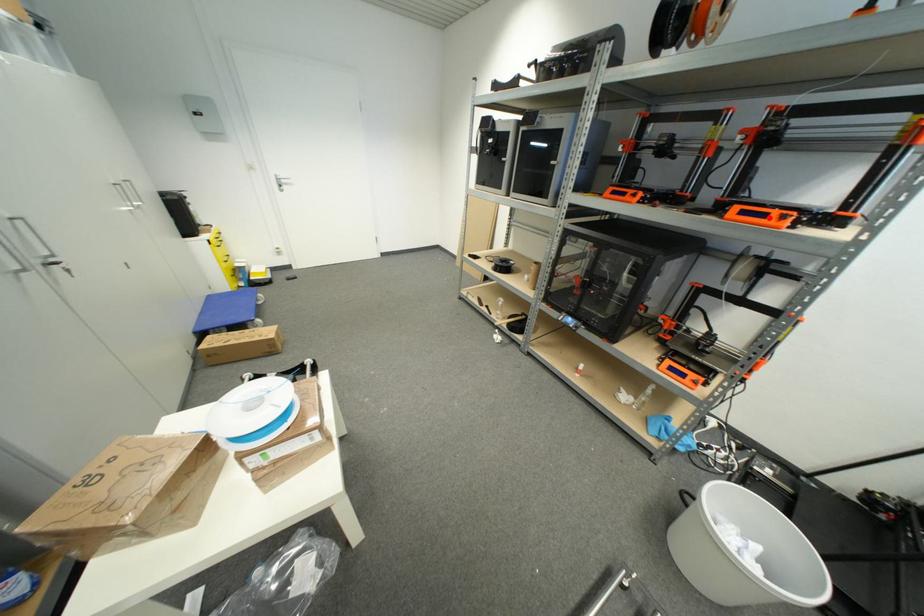
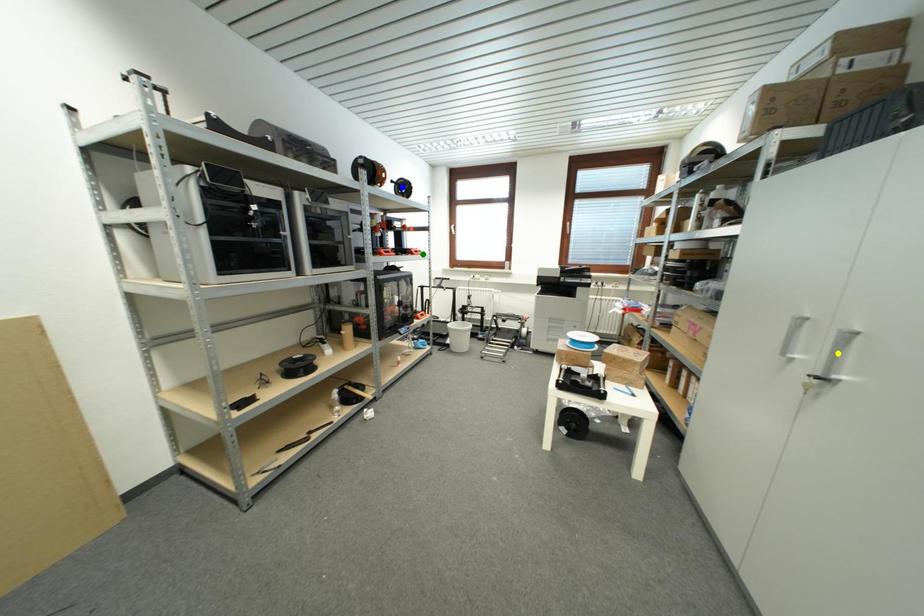
Question: I am providing you with two images of the same scene from different viewpoints. A red point is marked on the first image. You are given multiple points on the second image. In image 2, which mark is for the same physical point as the one in image 1?

Choices:
 (A) green point
 (B) yellow point
 (C) blue point

Answer: (A)